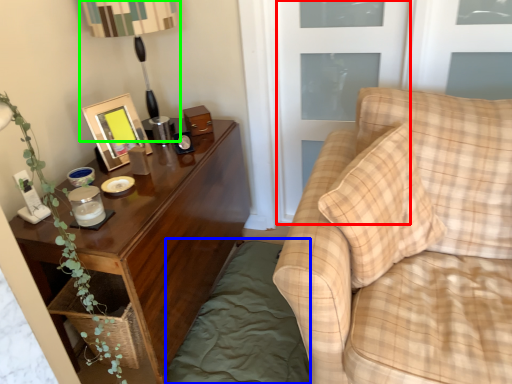
Question: Considering the real-world distances, which object is farthest from screen door (highlighted by a red box)? bedding (highlighted by a blue box) or table lamp (highlighted by a green box)?

Choices:
 (A) bedding
 (B) table lamp

Answer: (A)